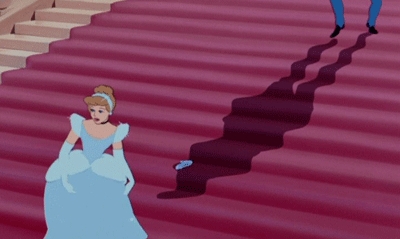
This screenshot has height=239, width=400. Find the location of `bright maroon or pink staircase`. bright maroon or pink staircase is located at coordinates (168, 91).